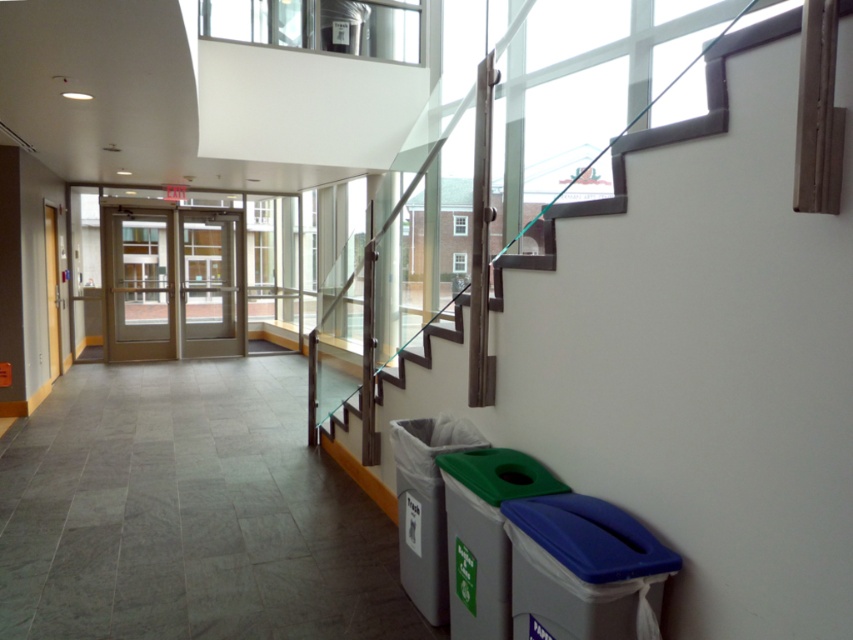
Which is above, blue plastic recycling bin at lower right or gray plastic recycling bin at lower right?

blue plastic recycling bin at lower right is above.

Is the position of blue plastic recycling bin at lower right more distant than that of gray plastic recycling bin at lower right?

No.

Is point (581, 604) farther from viewer compared to point (418, 458)?

No, it is in front of (418, 458).

Identify the location of blue plastic recycling bin at lower right. The height and width of the screenshot is (640, 853). (582, 570).

Does blue plastic recycling bin at lower right appear under green plastic recycling bin at lower right?

Incorrect, blue plastic recycling bin at lower right is not positioned below green plastic recycling bin at lower right.

Does point (512, 616) lie in front of point (457, 465)?

That is True.

You are a GUI agent. You are given a task and a screenshot of the screen. Output one action in this format:
    pyautogui.click(x=<x>, y=<y>)
    Task: Click on the blue plastic recycling bin at lower right
    
    Given the screenshot: What is the action you would take?
    coord(582,570)

Does green plastic recycling bin at lower right have a smaller size compared to gray plastic recycling bin at lower right?

Yes.

Is green plastic recycling bin at lower right to the right of gray plastic recycling bin at lower right from the viewer's perspective?

Correct, you'll find green plastic recycling bin at lower right to the right of gray plastic recycling bin at lower right.

Does point (523, 465) come behind point (434, 621)?

No, it is in front of (434, 621).

At what (x,y) coordinates should I click in order to perform the action: click on green plastic recycling bin at lower right. Please return your answer as a coordinate pair (x, y). This screenshot has height=640, width=853. Looking at the image, I should click on (485, 532).